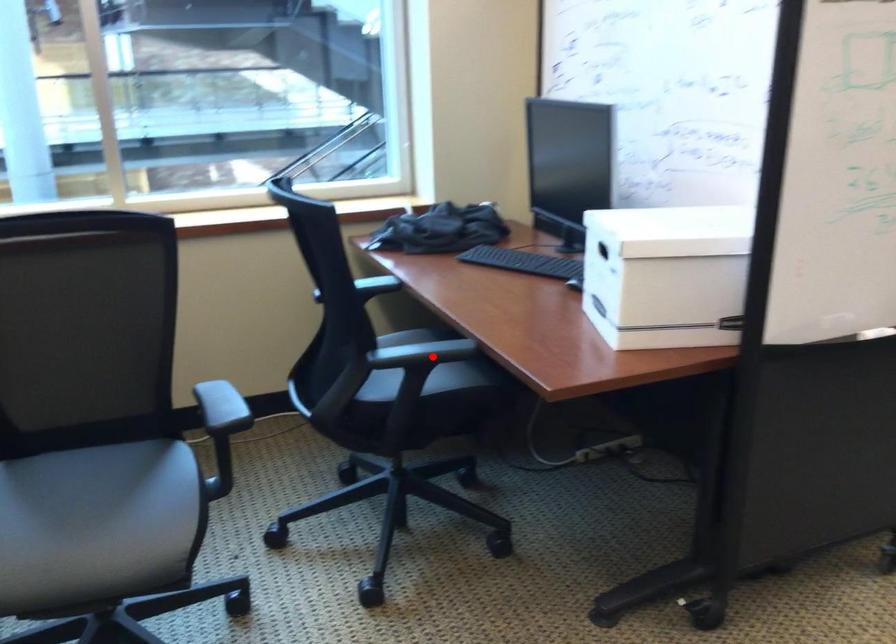
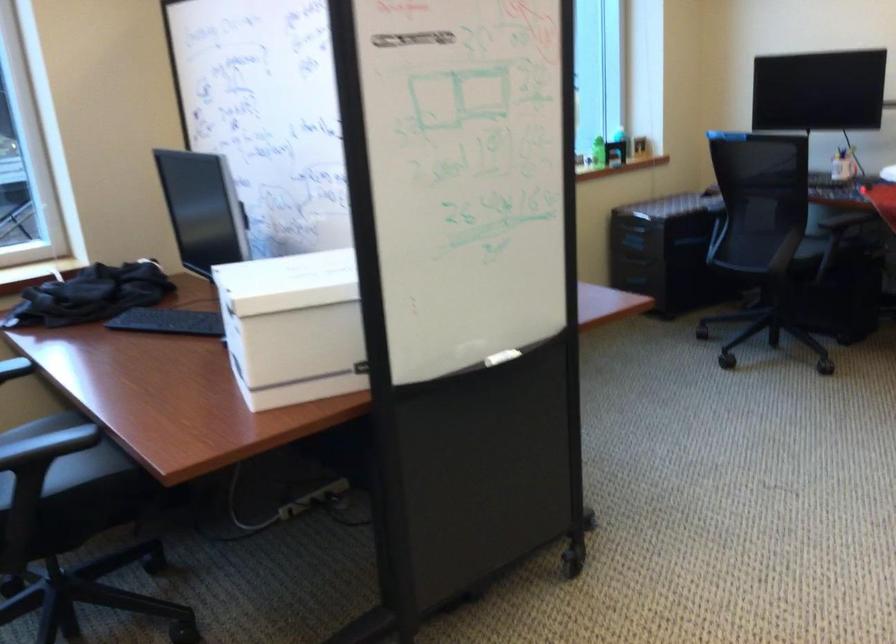
Find the pixel in the second image that matches the highlighted location in the first image.

(47, 446)